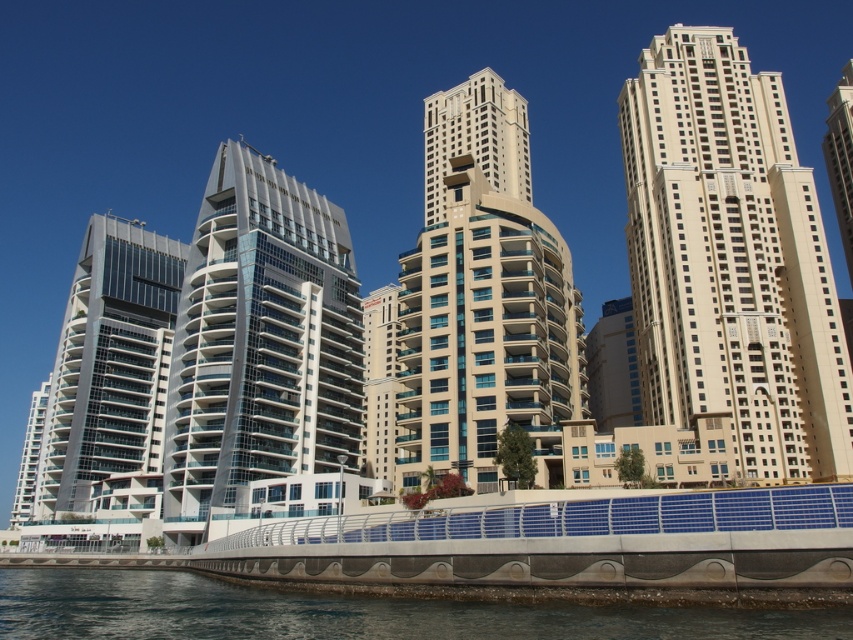
Question: Estimate the real-world distances between objects in this image. Which object is closer to the white glossy building at center?

Choices:
 (A) white glass building at center
 (B) beige glass tower at upper right
 (C) clear water at lower left
 (D) beige glass building at right

Answer: (A)

Question: Does beige glass building at center have a larger size compared to white glass building at center?

Choices:
 (A) no
 (B) yes

Answer: (B)

Question: Which object is positioned farthest from the clear water at lower left?

Choices:
 (A) beige glass building at center
 (B) white glossy building at center
 (C) beige glass tower at upper right

Answer: (C)

Question: Does metallic glass building at left appear on the right side of white glossy building at center?

Choices:
 (A) no
 (B) yes

Answer: (A)

Question: Is white glossy building at center bigger than beige glass tower at upper right?

Choices:
 (A) yes
 (B) no

Answer: (B)

Question: Which of the following is the farthest from the observer?

Choices:
 (A) (448, 131)
 (B) (846, 97)
 (C) (82, 611)

Answer: (A)